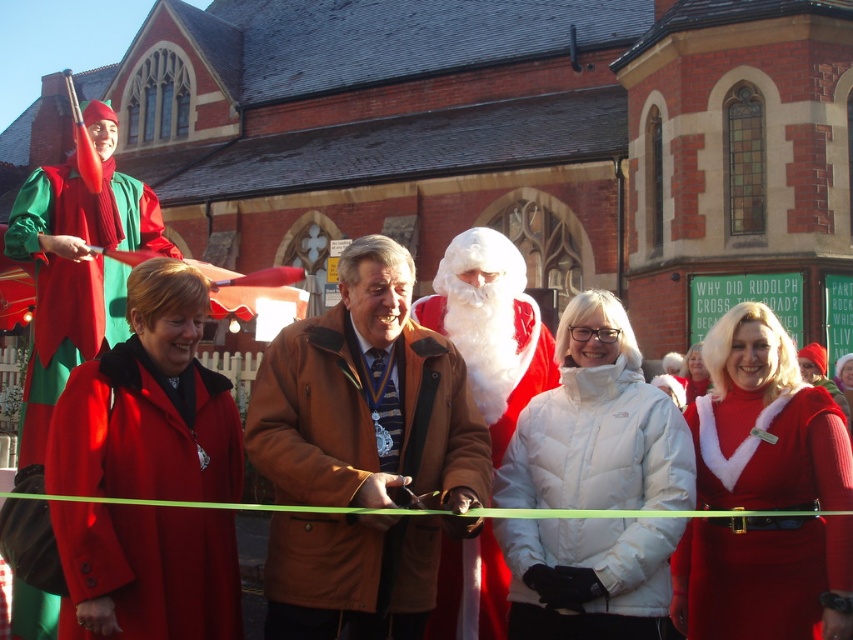
You are standing in front of the festive scene at the red brick building. There are two points marked in the image. Which point, point (364, 307) or point (517, 362), is closer to you?

Point (364, 307) is closer to the camera than point (517, 362), so it is closer to you.

Based on the photo, you are attending a ribbon cutting ceremony at the festive event. You notice the brown leather jacket at center and the white fluffy Santa at center. Which one is closer to you?

The brown leather jacket at center is closer to you because it is in front of the white fluffy Santa at center.